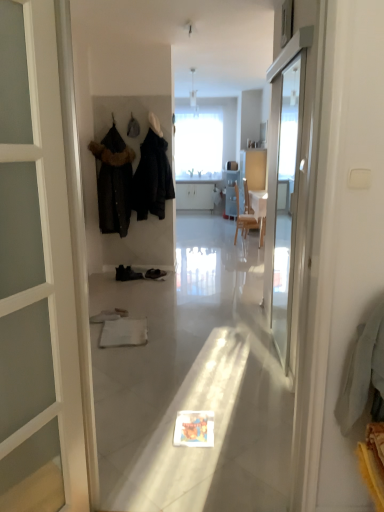
Question: Is point (145, 144) closer or farther from the camera than point (114, 190)?

Choices:
 (A) closer
 (B) farther

Answer: (B)

Question: From a real-world perspective, is dark matte coat at center, placed as the 2th clothing when sorted from left to right, above or below black fur-trimmed coat at left, the 2th clothing positioned from the right?

Choices:
 (A) above
 (B) below

Answer: (A)

Question: Estimate the real-world distances between objects in this image. Which object is closer to the dark matte coat at center, placed as the 2th clothing when sorted from left to right?

Choices:
 (A) black fur-trimmed coat at left, the 2th clothing positioned from the right
 (B) transparent glass screen door at right

Answer: (A)

Question: Estimate the real-world distances between objects in this image. Which object is farther from the transparent glass screen door at right?

Choices:
 (A) dark matte coat at center, placed as the 2th clothing when sorted from left to right
 (B) black fur-trimmed coat at left, the 2th clothing positioned from the right

Answer: (B)